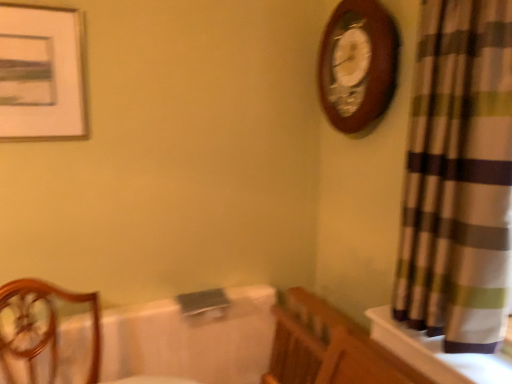
The image size is (512, 384). What are the coordinates of `wooden chair at left` in the screenshot? It's located at (45, 326).

The image size is (512, 384). Describe the element at coordinates (458, 177) in the screenshot. I see `plaid fabric curtain at right` at that location.

At what (x,y) coordinates should I click in order to perform the action: click on matte white picture frame at upper left. Please return your answer as a coordinate pair (x, y). Image resolution: width=512 pixels, height=384 pixels. Looking at the image, I should click on (40, 73).

How many degrees apart are the facing directions of wooden chair at left and plaid fabric curtain at right?

wooden chair at left and plaid fabric curtain at right are facing 97.8 degrees away from each other.

Is plaid fabric curtain at right located within wooden chair at left?

No, wooden chair at left does not contain plaid fabric curtain at right.

Between wooden chair at left and plaid fabric curtain at right, which one has more height?

plaid fabric curtain at right.

From the image's perspective, between wooden chair at left and plaid fabric curtain at right, which one is located above?

plaid fabric curtain at right.

Is wooden chair at left looking in the opposite direction of white glossy bath at center?

wooden chair at left is not turned away from white glossy bath at center.

Considering the sizes of wooden chair at left and white glossy bath at center in the image, is wooden chair at left taller or shorter than white glossy bath at center?

wooden chair at left is shorter than white glossy bath at center.

The image size is (512, 384). Identify the location of bath below the wooden chair at left (from the image's perspective). (191, 340).

Consider the image. Is wooden chair at left next to matte white picture frame at upper left?

wooden chair at left and matte white picture frame at upper left are clearly separated.

Can we say wooden chair at left lies outside matte white picture frame at upper left?

Yes, wooden chair at left is outside of matte white picture frame at upper left.

Based on the photo, can you tell me how much wooden chair at left and matte white picture frame at upper left differ in facing direction?

There is a 7.6-degree angle between the facing directions of wooden chair at left and matte white picture frame at upper left.

Considering the sizes of objects wooden chair at left and matte white picture frame at upper left in the image provided, who is thinner, wooden chair at left or matte white picture frame at upper left?

Thinner between the two is matte white picture frame at upper left.

Does plaid fabric curtain at right appear on the left side of wooden wall clock at upper right?

No.

From the image's perspective, which one is positioned lower, plaid fabric curtain at right or wooden wall clock at upper right?

plaid fabric curtain at right.

Is plaid fabric curtain at right thinner than wooden wall clock at upper right?

Incorrect, the width of plaid fabric curtain at right is not less than that of wooden wall clock at upper right.

Is plaid fabric curtain at right oriented towards wooden wall clock at upper right?

No.

Measure the distance between white glossy bath at center and wooden wall clock at upper right.

A distance of 3.60 feet exists between white glossy bath at center and wooden wall clock at upper right.

From the image's perspective, which is above, white glossy bath at center or wooden wall clock at upper right?

wooden wall clock at upper right is shown above in the image.

Would you say white glossy bath at center is a long distance from wooden wall clock at upper right?

Yes.

From the image's perspective, is plaid fabric curtain at right on top of matte white picture frame at upper left?

Incorrect, from the image's perspective, plaid fabric curtain at right is lower than matte white picture frame at upper left.

From a real-world perspective, does plaid fabric curtain at right stand above matte white picture frame at upper left?

No, from a real-world perspective, plaid fabric curtain at right is not above matte white picture frame at upper left.

Can you confirm if plaid fabric curtain at right is wider than matte white picture frame at upper left?

Yes.

Find the location of a particular element. This screenshot has height=384, width=512. picture frame above the plaid fabric curtain at right (from a real-world perspective) is located at coordinates (40, 73).

How many degrees apart are the facing directions of matte white picture frame at upper left and wooden chair at left?

They differ by 7.6 degrees in their facing directions.

Looking at this image, does matte white picture frame at upper left have a greater height compared to wooden chair at left?

Yes, matte white picture frame at upper left is taller than wooden chair at left.

Would you say matte white picture frame at upper left is to the left or to the right of wooden chair at left in the picture?

Clearly, matte white picture frame at upper left is on the left of wooden chair at left in the image.

Between matte white picture frame at upper left and wooden chair at left, which one is positioned in front?

wooden chair at left is more forward.

Locate an element on the screen. Image resolution: width=512 pixels, height=384 pixels. furniture behind the plaid fabric curtain at right is located at coordinates (45, 326).

Where is `furniture above the white glossy bath at center (from a real-world perspective)`? furniture above the white glossy bath at center (from a real-world perspective) is located at coordinates pos(45,326).

When comparing their distances from white glossy bath at center, does matte white picture frame at upper left or wooden chair at left seem closer?

wooden chair at left is closer to white glossy bath at center.

Considering their positions, is matte white picture frame at upper left positioned closer to wooden wall clock at upper right than plaid fabric curtain at right?

Among the two, plaid fabric curtain at right is located nearer to wooden wall clock at upper right.

Considering their positions, is wooden chair at left positioned closer to wooden wall clock at upper right than plaid fabric curtain at right?

Based on the image, plaid fabric curtain at right appears to be nearer to wooden wall clock at upper right.

Estimate the real-world distances between objects in this image. Which object is closer to white glossy bath at center, wooden chair at left or plaid fabric curtain at right?

wooden chair at left lies closer to white glossy bath at center than the other object.

Considering their positions, is wooden wall clock at upper right positioned closer to matte white picture frame at upper left than plaid fabric curtain at right?

wooden wall clock at upper right lies closer to matte white picture frame at upper left than the other object.

Looking at the image, which one is located closer to matte white picture frame at upper left, wooden chair at left or wooden wall clock at upper right?

Among the two, wooden chair at left is located nearer to matte white picture frame at upper left.

Estimate the real-world distances between objects in this image. Which object is further from plaid fabric curtain at right, matte white picture frame at upper left or wooden chair at left?

Among the two, matte white picture frame at upper left is located further to plaid fabric curtain at right.

When comparing their distances from wooden wall clock at upper right, does white glossy bath at center or wooden chair at left seem closer?

white glossy bath at center is closer to wooden wall clock at upper right.

I want to click on furniture between matte white picture frame at upper left and wooden wall clock at upper right from left to right, so coord(45,326).

The width and height of the screenshot is (512, 384). I want to click on bath located between wooden chair at left and plaid fabric curtain at right in the left-right direction, so click(x=191, y=340).

The width and height of the screenshot is (512, 384). I want to click on furniture between wooden wall clock at upper right and white glossy bath at center in the up-down direction, so click(x=45, y=326).

I want to click on furniture between matte white picture frame at upper left and white glossy bath at center in the vertical direction, so click(45, 326).